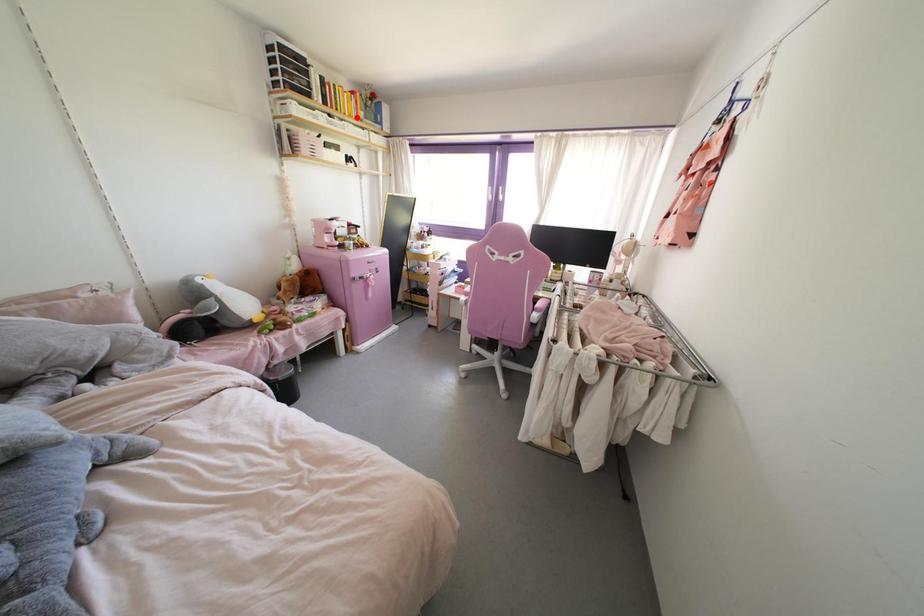
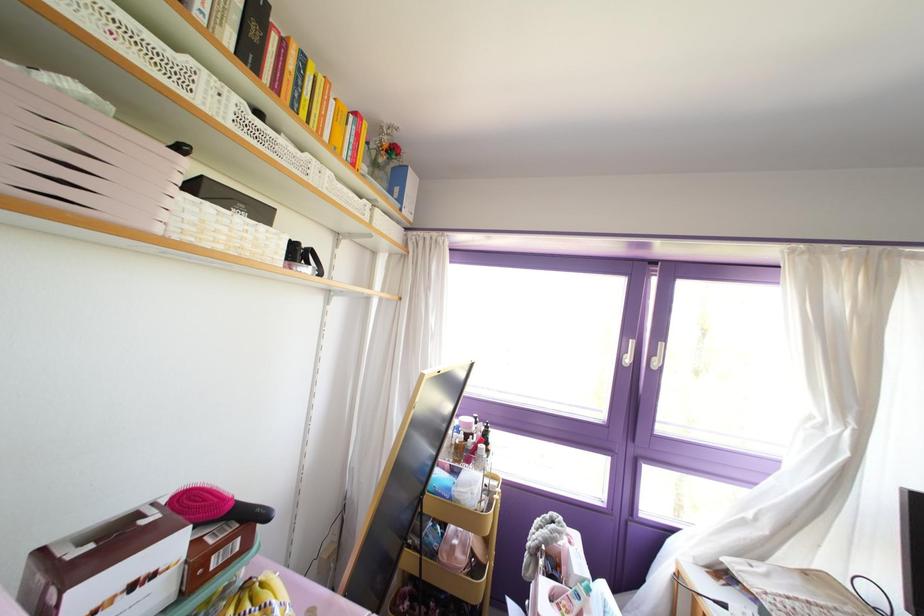
The point at the highlighted location is marked in the first image. Where is the corresponding point in the second image?

(351, 164)